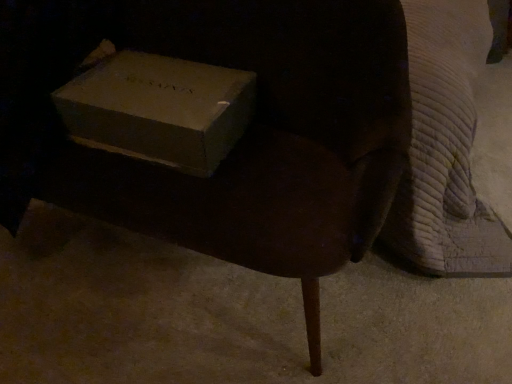
Describe the element at coordinates (159, 109) in the screenshot. I see `matte cardboard box at center` at that location.

This screenshot has height=384, width=512. In order to click on matte cardboard box at center in this screenshot , I will do `click(159, 109)`.

The width and height of the screenshot is (512, 384). Find the location of `matte cardboard box at center`. matte cardboard box at center is located at coordinates [x=159, y=109].